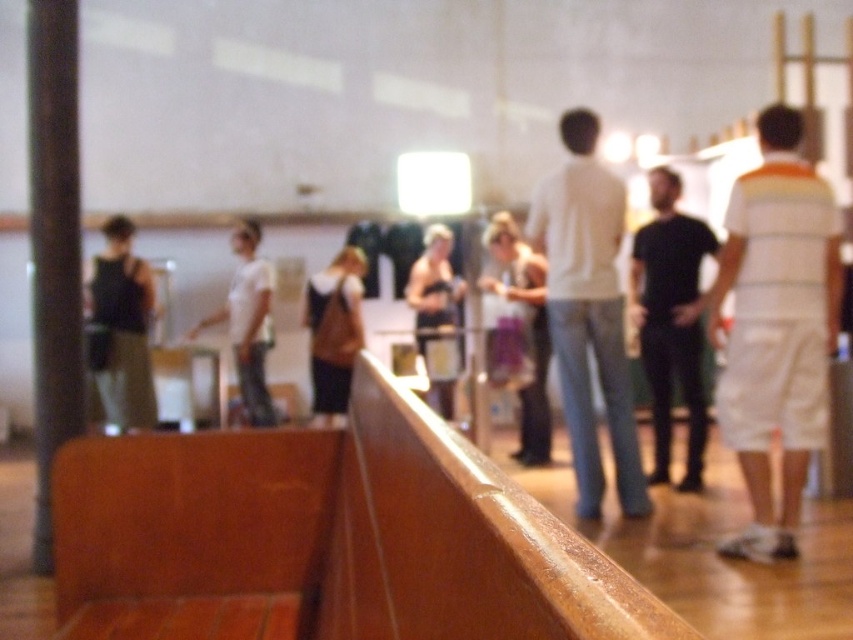
Question: Which point is closer to the camera?

Choices:
 (A) matte black tank top at left
 (B) brown leather bag at center
 (C) shiny black tank top at center

Answer: (A)

Question: Considering the relative positions of white striped shirt at right and brown leather bag at center in the image provided, where is white striped shirt at right located with respect to brown leather bag at center?

Choices:
 (A) below
 (B) above

Answer: (A)

Question: Considering the real-world distances, which object is farthest from the white matte shirt at center?

Choices:
 (A) matte purple skirt at center
 (B) brown leather bag at center
 (C) black matte shirt at center
 (D) shiny black tank top at center

Answer: (D)

Question: Which point appears closest to the camera in this image?

Choices:
 (A) (543, 310)
 (B) (798, 305)
 (C) (669, 416)

Answer: (B)

Question: Does black matte shirt at center appear under white cotton shirt at center?

Choices:
 (A) no
 (B) yes

Answer: (A)

Question: Is matte black tank top at left smaller than brown leather bag at center?

Choices:
 (A) no
 (B) yes

Answer: (B)